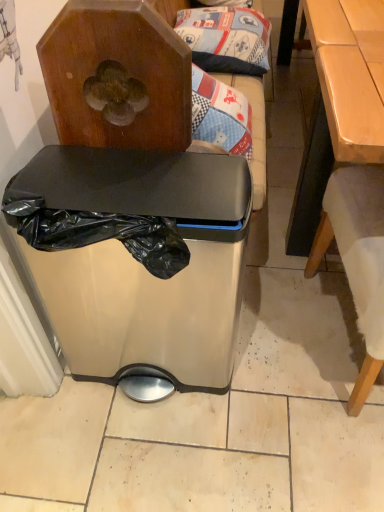
Question: Based on their sizes in the image, would you say patterned fabric pillow at upper center is bigger or smaller than satin silver trash can at center?

Choices:
 (A) big
 (B) small

Answer: (B)

Question: From the image's perspective, is patterned fabric pillow at upper center above or below satin silver trash can at center?

Choices:
 (A) above
 (B) below

Answer: (A)

Question: Estimate the real-world distances between objects in this image. Which object is farther from the patterned fabric pillow at upper center?

Choices:
 (A) satin silver trash can at center
 (B) light brown wooden table at right

Answer: (A)

Question: Which object is positioned closest to the satin silver trash can at center?

Choices:
 (A) patterned fabric pillow at upper center
 (B) light brown wooden table at right

Answer: (B)